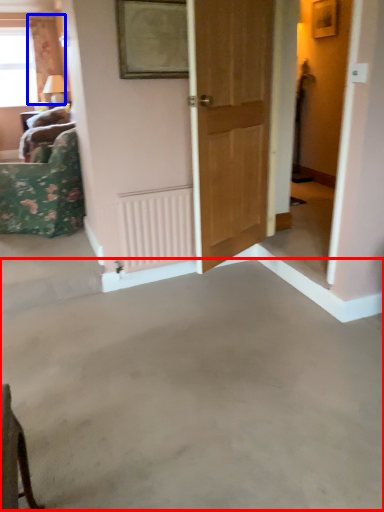
Question: Which object is further to the camera taking this photo, concrete (highlighted by a red box) or curtain (highlighted by a blue box)?

Choices:
 (A) concrete
 (B) curtain

Answer: (B)